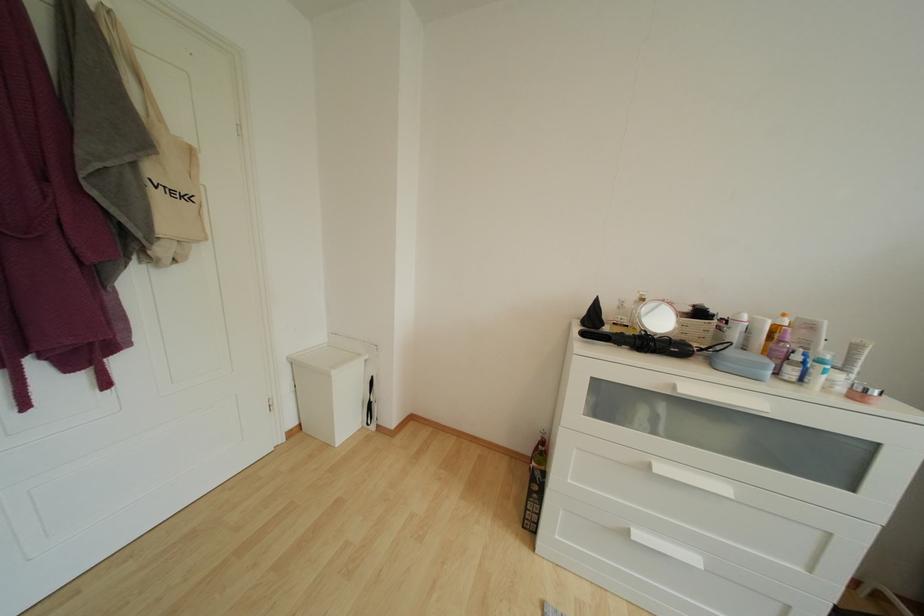
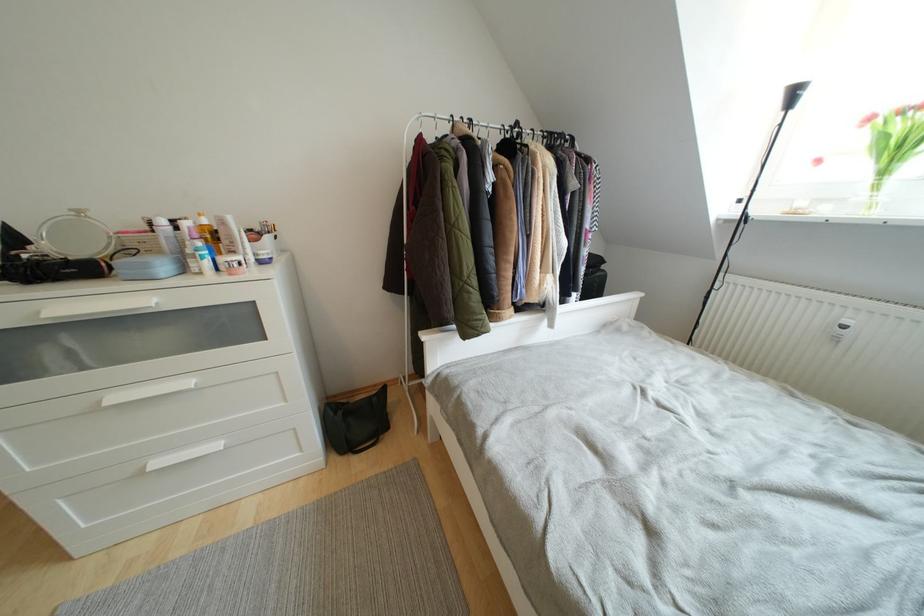
In the second image, find the point that corresponds to pixel 665 472 in the first image.

(120, 402)